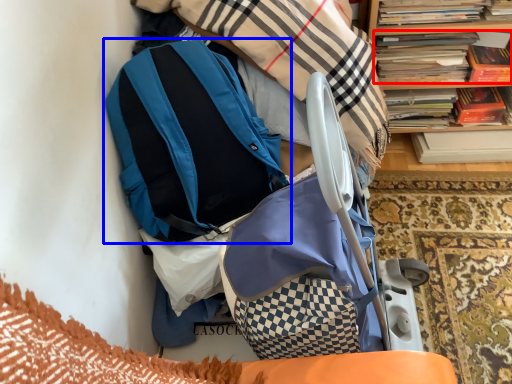
Question: Which object appears farthest to the camera in this image, book (highlighted by a red box) or backpack (highlighted by a blue box)?

Choices:
 (A) book
 (B) backpack

Answer: (A)